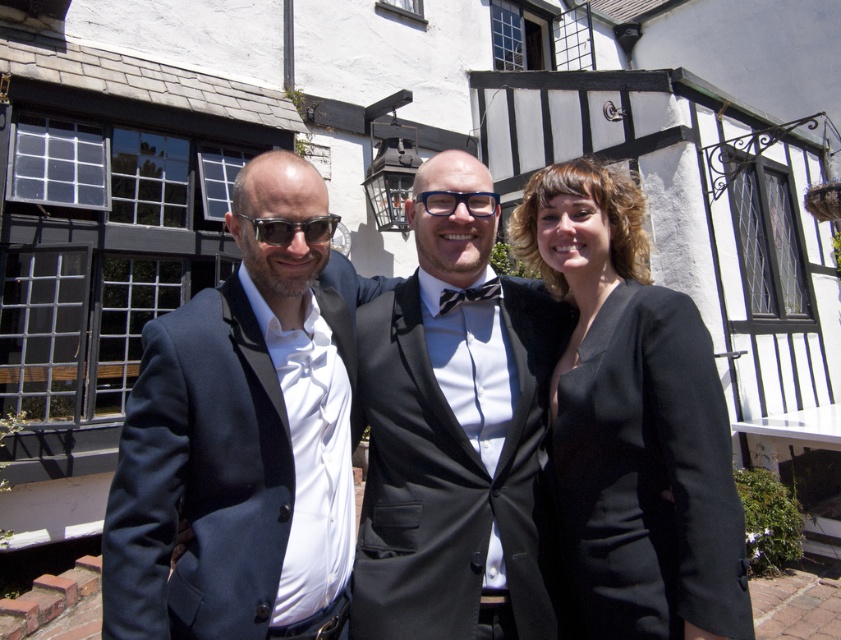
Can you confirm if navy wool suit at center is positioned below blue plastic glasses at center?

Yes.

Is point (346, 326) positioned in front of point (479, 202)?

No.

Image resolution: width=841 pixels, height=640 pixels. In order to click on navy wool suit at center in this screenshot , I will do `click(234, 456)`.

The height and width of the screenshot is (640, 841). In order to click on navy wool suit at center in this screenshot , I will do `click(234, 456)`.

Does navy wool suit at center appear on the right side of matte black sunglasses at center?

No, navy wool suit at center is not to the right of matte black sunglasses at center.

Locate an element on the screen. The width and height of the screenshot is (841, 640). navy wool suit at center is located at coordinates (234, 456).

Describe the element at coordinates (234, 456) in the screenshot. This screenshot has width=841, height=640. I see `navy wool suit at center` at that location.

Between point (118, 564) and point (365, 579), which one is positioned in front?

Point (118, 564) is more forward.

Which is behind, point (348, 508) or point (509, 346)?

The point (509, 346) is behind.

Where is `navy wool suit at center`? Image resolution: width=841 pixels, height=640 pixels. navy wool suit at center is located at coordinates (234, 456).